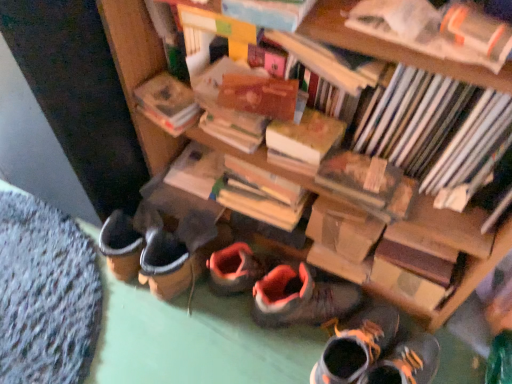
Locate an element on the screen. The width and height of the screenshot is (512, 384). vacant space that is to the left of orange suede sneaker at center, positioned as the first footwear in left-to-right order is located at coordinates (221, 339).